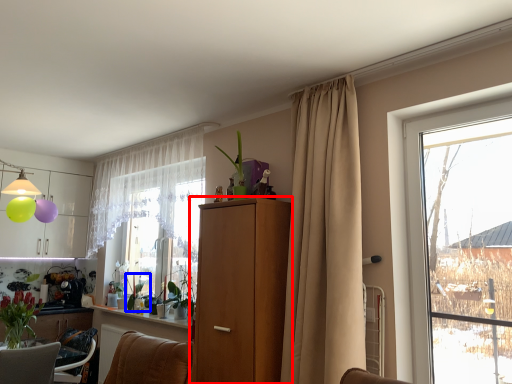
Question: Which object is further to the camera taking this photo, cabinetry (highlighted by a red box) or plant (highlighted by a blue box)?

Choices:
 (A) cabinetry
 (B) plant

Answer: (B)